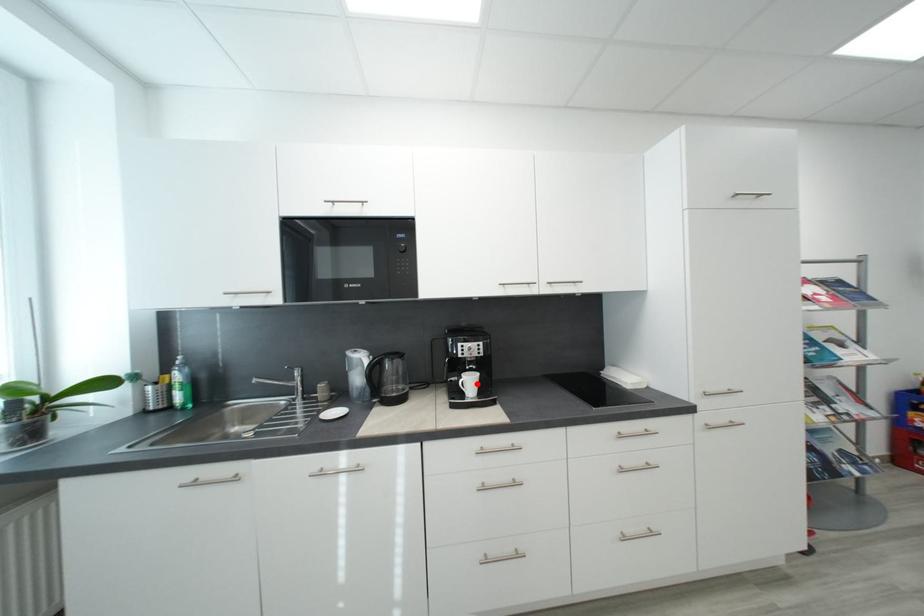
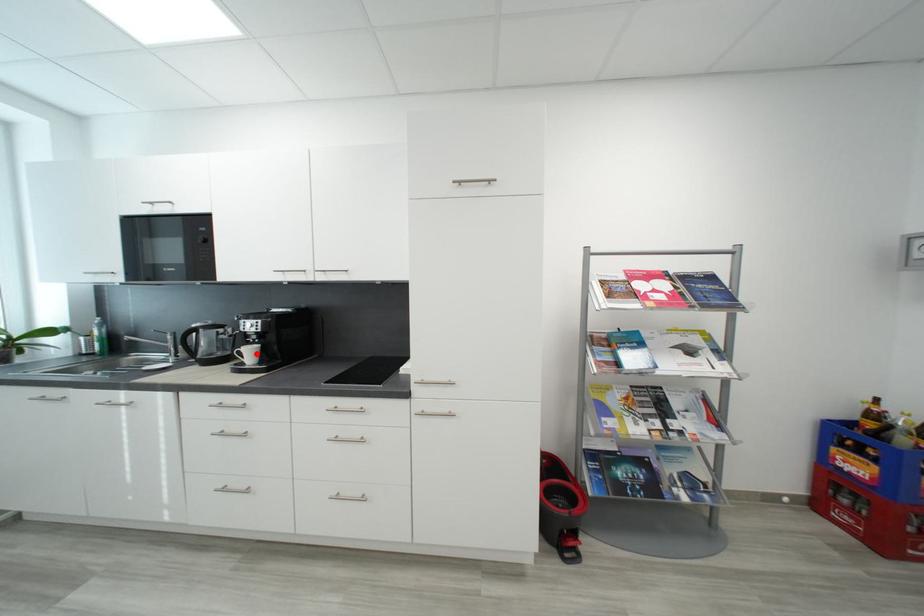
I am providing you with two images of the same scene from different viewpoints. A red point is marked on the first image and another point is marked on the second image. Is the marked point in image1 the same physical position as the marked point in image2?

Yes